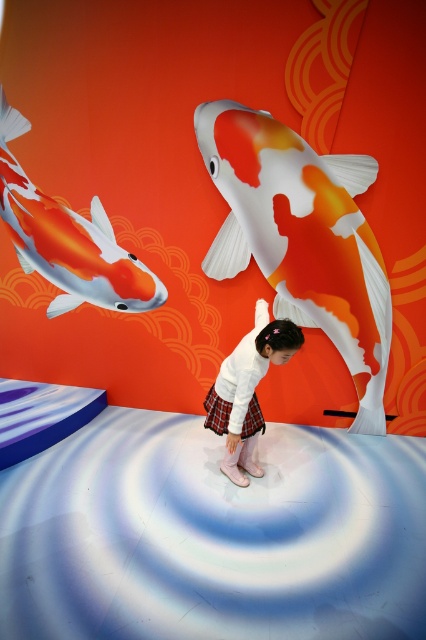
Question: Which of the following is the farthest from the observer?

Choices:
 (A) white matte skirt at center
 (B) orange and white glossy koi fish at upper left
 (C) orange and white painted fish at center

Answer: (A)

Question: Estimate the real-world distances between objects in this image. Which object is closer to the orange and white painted fish at center?

Choices:
 (A) orange and white glossy koi fish at upper left
 (B) white matte skirt at center

Answer: (B)

Question: Does orange and white painted fish at center appear on the right side of white matte skirt at center?

Choices:
 (A) yes
 (B) no

Answer: (A)

Question: Is orange and white painted fish at center smaller than orange and white glossy koi fish at upper left?

Choices:
 (A) yes
 (B) no

Answer: (B)

Question: Among these points, which one is farthest from the camera?

Choices:
 (A) (28, 200)
 (B) (241, 419)
 (C) (371, 333)

Answer: (B)

Question: Can you confirm if orange and white glossy koi fish at upper left is positioned to the left of white matte skirt at center?

Choices:
 (A) yes
 (B) no

Answer: (A)